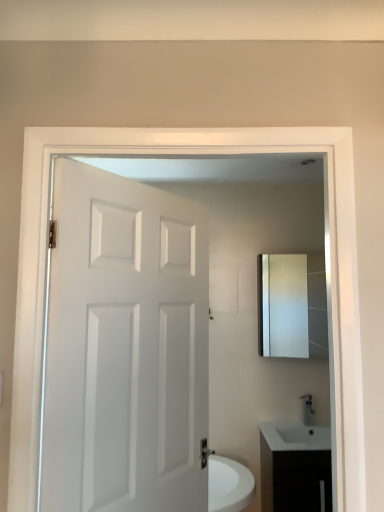
Question: In the image, is white glossy cabinet at lower right positioned in front of or behind satin nickel faucet at lower right?

Choices:
 (A) behind
 (B) front

Answer: (B)

Question: From a real-world perspective, is white glossy cabinet at lower right above or below satin nickel faucet at lower right?

Choices:
 (A) above
 (B) below

Answer: (B)

Question: Which is nearer to the white glossy cabinet at lower right?

Choices:
 (A) matte silver medicine cabinet at upper right
 (B) white matte door at center
 (C) satin nickel faucet at lower right

Answer: (C)

Question: Which of these objects is positioned farthest from the satin nickel faucet at lower right?

Choices:
 (A) white glossy cabinet at lower right
 (B) matte silver medicine cabinet at upper right
 (C) white matte door at center

Answer: (C)